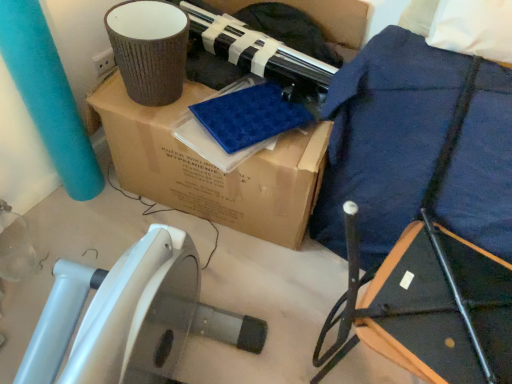
This screenshot has height=384, width=512. What do you see at coordinates (417, 146) in the screenshot?
I see `navy blue fabric at upper right` at bounding box center [417, 146].

Where is `navy blue fabric at upper right`? navy blue fabric at upper right is located at coordinates (417, 146).

What do you see at coordinates (212, 167) in the screenshot? I see `brown cardboard box at upper center` at bounding box center [212, 167].

Where is `brown cardboard box at upper center`? This screenshot has width=512, height=384. brown cardboard box at upper center is located at coordinates (212, 167).

At what (x,y) coordinates should I click in order to perform the action: click on navy blue fabric at upper right. Please return your answer as a coordinate pair (x, y). Looking at the image, I should click on (417, 146).

Which object is positioned more to the right, navy blue fabric at upper right or brown cardboard box at upper center?

From the viewer's perspective, navy blue fabric at upper right appears more on the right side.

Is navy blue fabric at upper right positioned behind brown cardboard box at upper center?

No, the depth of navy blue fabric at upper right is less than that of brown cardboard box at upper center.

Is point (510, 214) positioned after point (322, 124)?

No, (510, 214) is in front of (322, 124).

From the image's perspective, is navy blue fabric at upper right on top of brown cardboard box at upper center?

No.

From a real-world perspective, is navy blue fabric at upper right physically located above or below brown cardboard box at upper center?

Clearly, from a real-world perspective, navy blue fabric at upper right is above brown cardboard box at upper center.

Which of these two, navy blue fabric at upper right or brown cardboard box at upper center, is wider?

brown cardboard box at upper center.

Based on the photo, considering the relative sizes of navy blue fabric at upper right and brown cardboard box at upper center in the image provided, is navy blue fabric at upper right shorter than brown cardboard box at upper center?

No.

From the picture: Considering the sizes of objects navy blue fabric at upper right and brown cardboard box at upper center in the image provided, who is bigger, navy blue fabric at upper right or brown cardboard box at upper center?

brown cardboard box at upper center.

Would you say navy blue fabric at upper right is outside brown cardboard box at upper center?

navy blue fabric at upper right is positioned outside brown cardboard box at upper center.

Is navy blue fabric at upper right in contact with brown cardboard box at upper center?

No, navy blue fabric at upper right is not with brown cardboard box at upper center.

Is navy blue fabric at upper right looking in the opposite direction of brown cardboard box at upper center?

navy blue fabric at upper right is not turned away from brown cardboard box at upper center.

How much distance is there between navy blue fabric at upper right and brown cardboard box at upper center?

navy blue fabric at upper right is 13.01 inches from brown cardboard box at upper center.

The width and height of the screenshot is (512, 384). Find the location of `blanket lying on the right of brown cardboard box at upper center`. blanket lying on the right of brown cardboard box at upper center is located at coordinates (417, 146).

Which is more to the right, brown cardboard box at upper center or navy blue fabric at upper right?

navy blue fabric at upper right is more to the right.

In the scene shown: Is brown cardboard box at upper center closer to the viewer compared to navy blue fabric at upper right?

No, brown cardboard box at upper center is further to the viewer.

Is point (104, 97) in front of point (380, 40)?

No, (104, 97) is behind (380, 40).

From the image's perspective, is brown cardboard box at upper center on top of navy blue fabric at upper right?

Indeed, from the image's perspective, brown cardboard box at upper center is shown above navy blue fabric at upper right.

From a real-world perspective, relative to navy blue fabric at upper right, is brown cardboard box at upper center vertically above or below?

In terms of real-world spatial position, brown cardboard box at upper center is below navy blue fabric at upper right.

Which object is wider, brown cardboard box at upper center or navy blue fabric at upper right?

With larger width is brown cardboard box at upper center.

Who is taller, brown cardboard box at upper center or navy blue fabric at upper right?

navy blue fabric at upper right.

Which of these two, brown cardboard box at upper center or navy blue fabric at upper right, is bigger?

With larger size is brown cardboard box at upper center.

Would you say brown cardboard box at upper center contains navy blue fabric at upper right?

No, navy blue fabric at upper right is not inside brown cardboard box at upper center.

Based on the photo, is brown cardboard box at upper center directly adjacent to navy blue fabric at upper right?

No, brown cardboard box at upper center is not with navy blue fabric at upper right.

Is brown cardboard box at upper center facing away from navy blue fabric at upper right?

That's not correct — brown cardboard box at upper center is not looking away from navy blue fabric at upper right.

How different are the orientations of brown cardboard box at upper center and navy blue fabric at upper right in degrees?

The facing directions of brown cardboard box at upper center and navy blue fabric at upper right are 13.3 degrees apart.

How far apart are brown cardboard box at upper center and navy blue fabric at upper right?

brown cardboard box at upper center is 33.03 centimeters from navy blue fabric at upper right.

Identify the location of box above the navy blue fabric at upper right (from the image's perspective). (212, 167).

At what (x,y) coordinates should I click in order to perform the action: click on blanket that appears below the brown cardboard box at upper center (from the image's perspective). Please return your answer as a coordinate pair (x, y). This screenshot has height=384, width=512. Looking at the image, I should click on (417, 146).

Find the location of a particular element. This screenshot has width=512, height=384. blanket above the brown cardboard box at upper center (from a real-world perspective) is located at coordinates (417, 146).